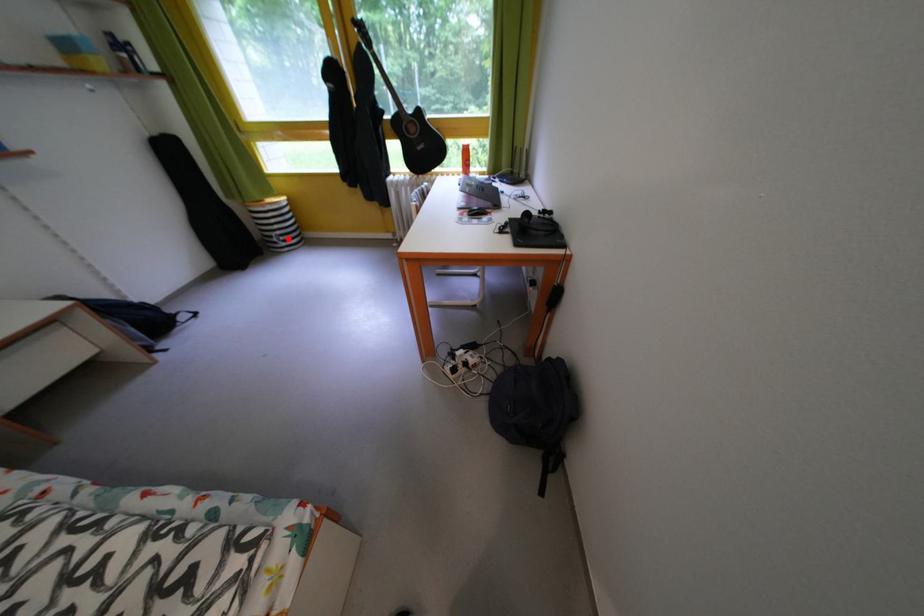
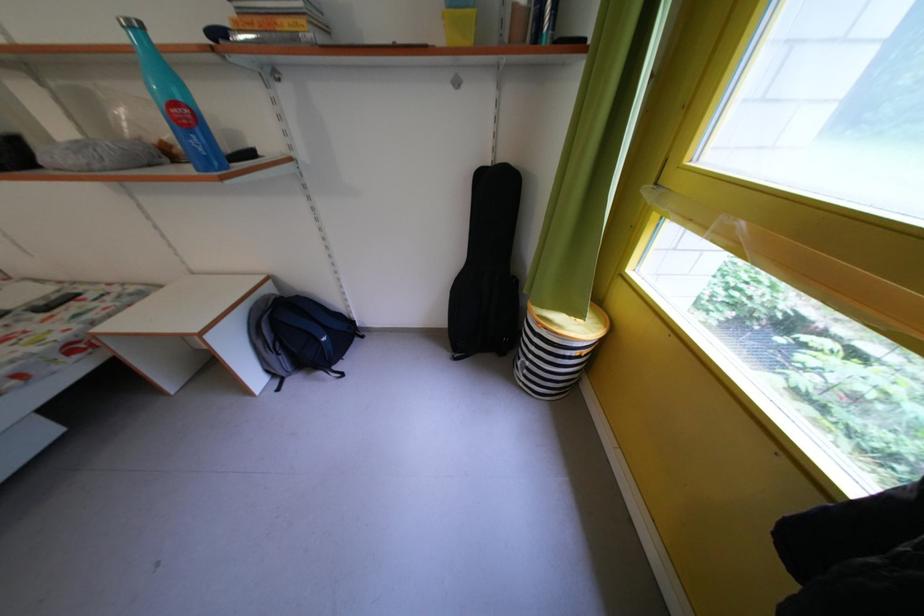
Question: I am providing you with two images of the same scene from different viewpoints. A red point is shown in image1. For the corresponding object point in image2, is it positioned nearer or farther from the camera?

Choices:
 (A) Nearer
 (B) Farther

Answer: (A)